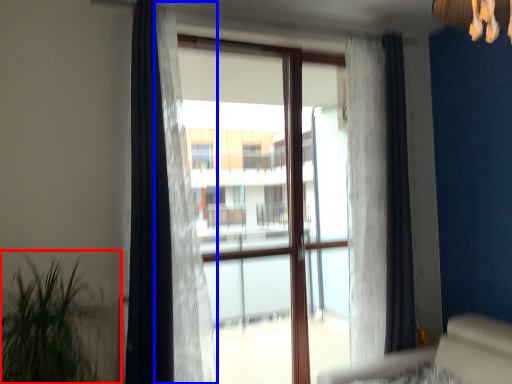
Question: Which point is further to the camera, houseplant (highlighted by a red box) or curtain (highlighted by a blue box)?

Choices:
 (A) houseplant
 (B) curtain

Answer: (B)